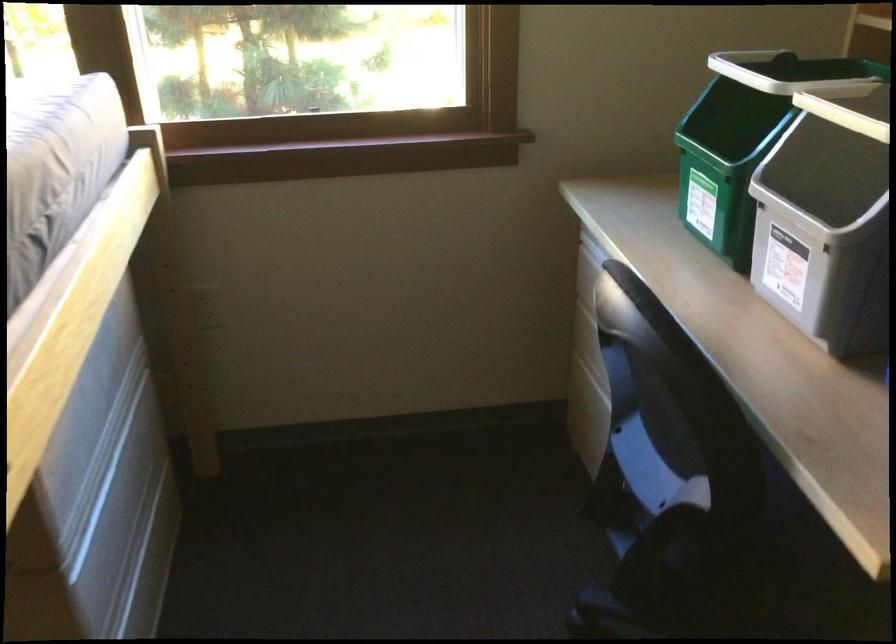
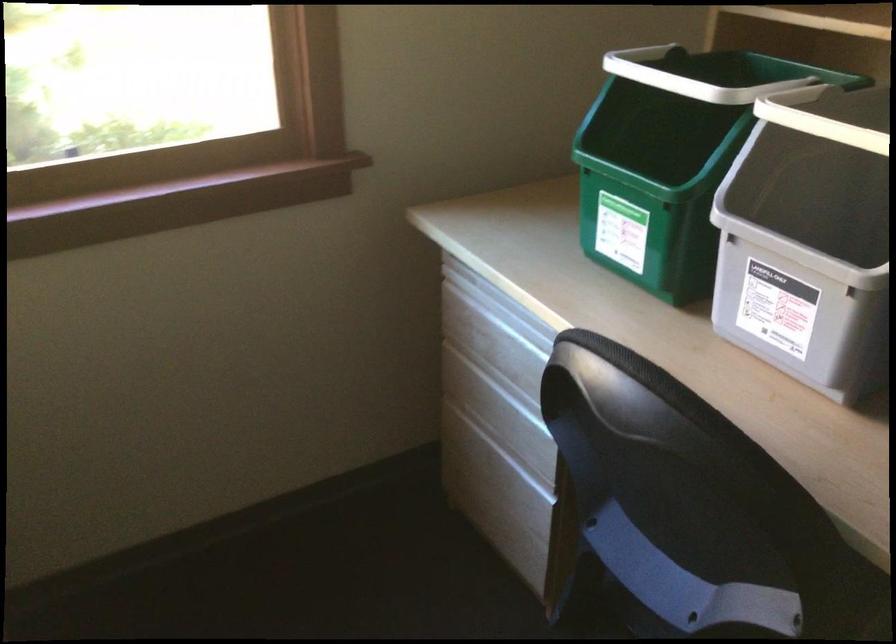
In the second image, find the point that corresponds to (716,169) in the first image.

(652, 194)